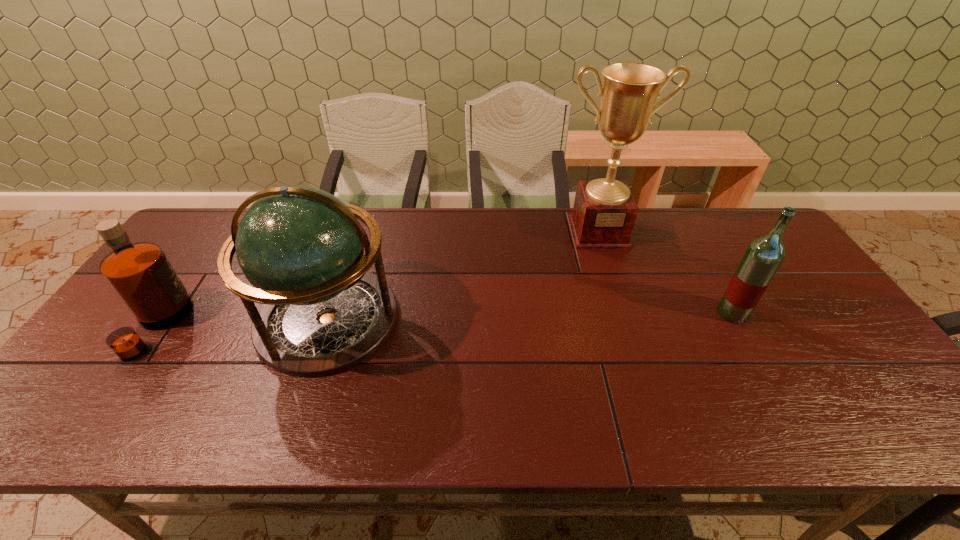
This screenshot has height=540, width=960. I want to click on object present at the far edge, so click(604, 212).

Find the location of `object that is at the left edge`. object that is at the left edge is located at coordinates (140, 274).

The image size is (960, 540). Identify the location of free space at the far edge of the desktop. (552, 219).

Find the location of a particular element. The height and width of the screenshot is (540, 960). vacant area at the near edge is located at coordinates (422, 403).

In the image, there is a desktop. At what (x,y) coordinates should I click in order to perform the action: click on vacant space at the right edge. Please return your answer as a coordinate pair (x, y). Looking at the image, I should click on click(801, 313).

The height and width of the screenshot is (540, 960). I want to click on free space at the far left corner of the desktop, so click(x=210, y=242).

You are a GUI agent. You are given a task and a screenshot of the screen. Output one action in this format:
    pyautogui.click(x=<x>, y=<y>)
    Task: Click on the free space between the globe and the third object from left to right
    This screenshot has width=960, height=540.
    Given the screenshot: What is the action you would take?
    pyautogui.click(x=463, y=275)

Locate an element on the screen. vacant area between the trophy cup and the rightmost object is located at coordinates (665, 273).

Where is `free space between the third object from left to right and the right liquor`? free space between the third object from left to right and the right liquor is located at coordinates (665, 273).

Locate an element on the screen. The height and width of the screenshot is (540, 960). vacant space in between the third object from left to right and the rightmost object is located at coordinates (665, 273).